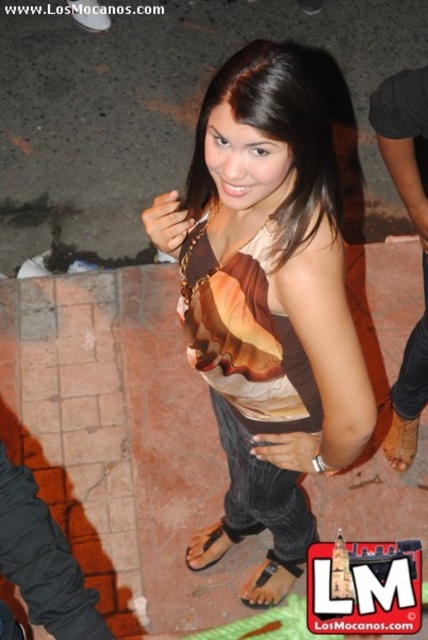
Based on the photo, between matte brown tank top at center and black fabric sandal at lower center, which one has less height?

black fabric sandal at lower center

Who is lower down, matte brown tank top at center or black fabric sandal at lower center?

black fabric sandal at lower center is lower down.

The height and width of the screenshot is (640, 428). Identify the location of matte brown tank top at center. (267, 291).

Describe the element at coordinates (419, 237) in the screenshot. I see `brown leather shoes at right` at that location.

Which is in front, point (401, 177) or point (398, 416)?

Point (401, 177)

The width and height of the screenshot is (428, 640). What are the coordinates of `brown leather shoes at right` in the screenshot? It's located at (419, 237).

Does matte brown tank top at center have a lesser height compared to brown fabric dress at center?

In fact, matte brown tank top at center may be taller than brown fabric dress at center.

Image resolution: width=428 pixels, height=640 pixels. What do you see at coordinates (267, 291) in the screenshot? I see `matte brown tank top at center` at bounding box center [267, 291].

Does point (297, 266) come farther from viewer compared to point (196, 173)?

No, it is not.

Locate an element on the screen. The image size is (428, 640). matte brown tank top at center is located at coordinates (267, 291).